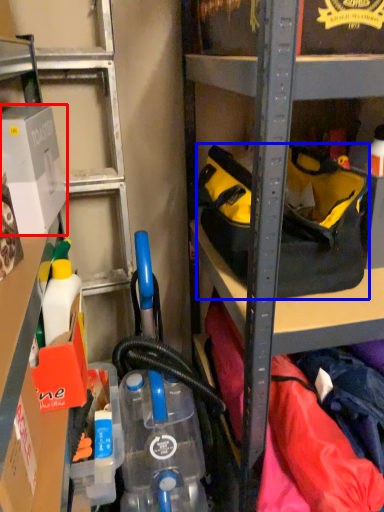
Question: Which object appears closest to the camera in this image, box (highlighted by a red box) or handbag (highlighted by a blue box)?

Choices:
 (A) box
 (B) handbag

Answer: (A)